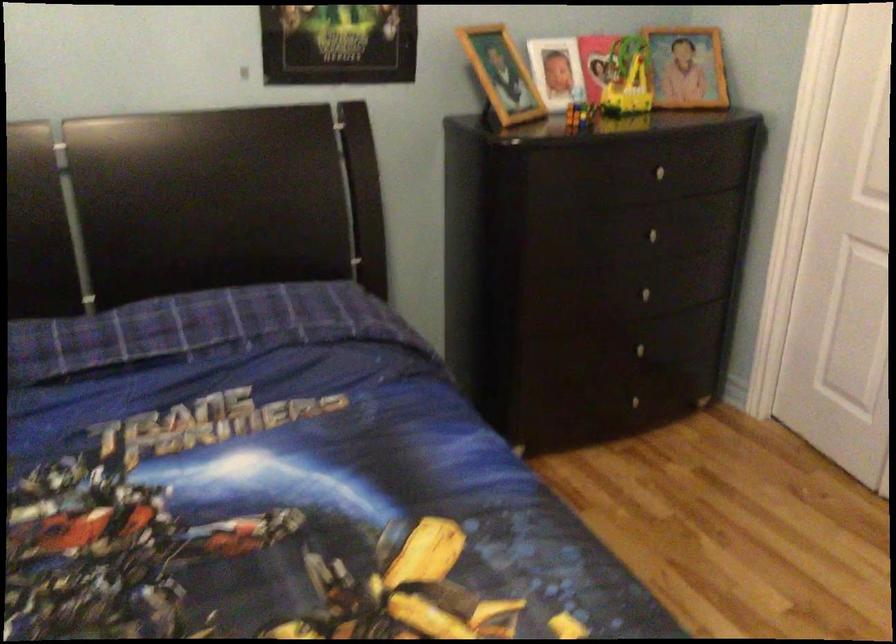
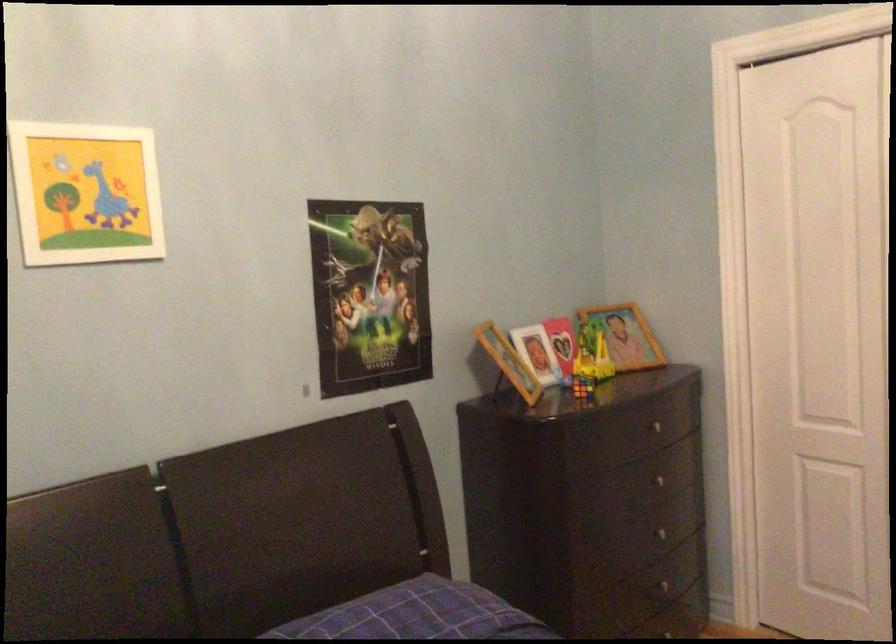
Where in the second image is the point corresponding to (647,287) from the first image?

(667, 532)